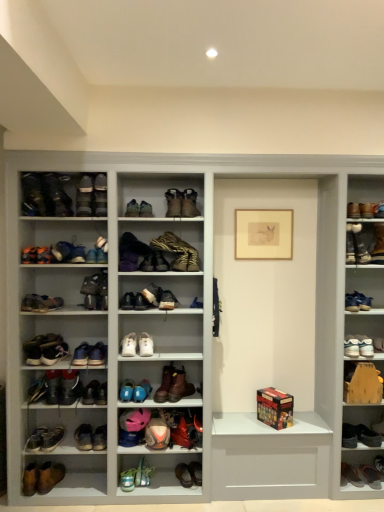
Where is `unoccupied region to the right of shiny teal sneakers at lower center, the 25th footwear viewed from the right`? unoccupied region to the right of shiny teal sneakers at lower center, the 25th footwear viewed from the right is located at coordinates (163, 489).